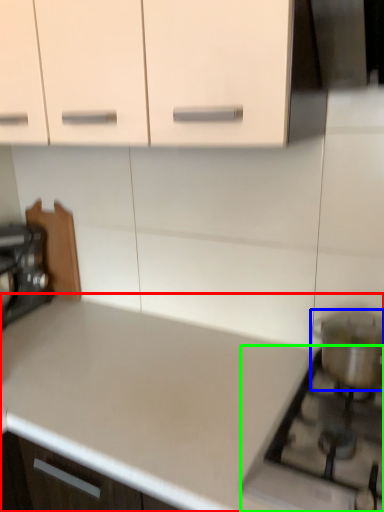
Question: Estimate the real-world distances between objects in this image. Which object is closer to countertop (highlighted by a red box), appliance (highlighted by a blue box) or gas stove (highlighted by a green box)?

Choices:
 (A) appliance
 (B) gas stove

Answer: (B)